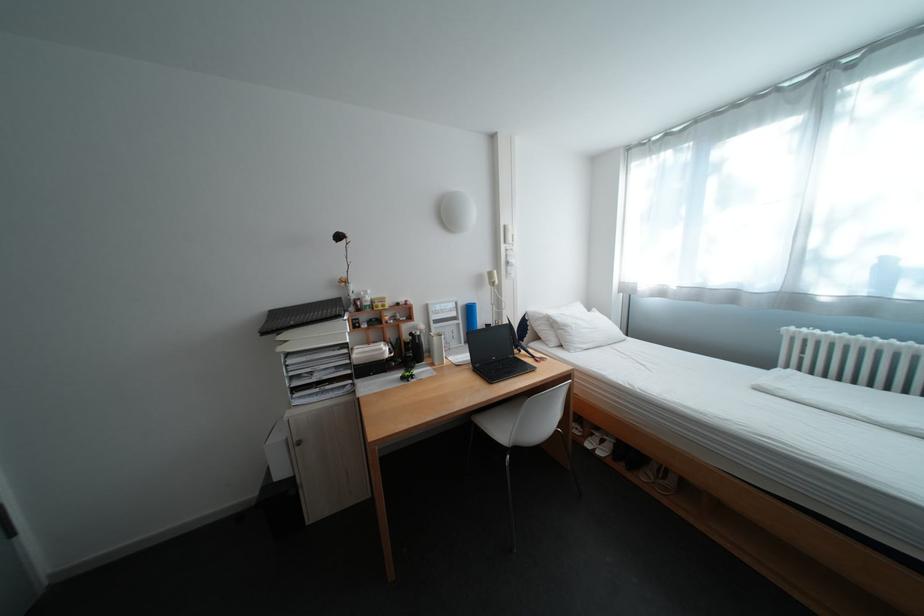
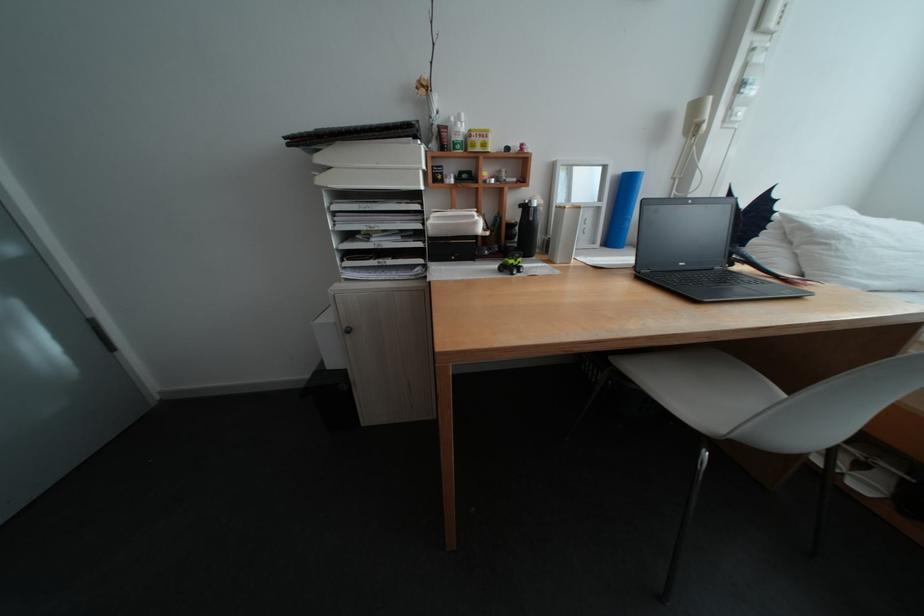
Locate, in the second image, the point that corresponds to point 368,301 in the first image.

(453, 128)